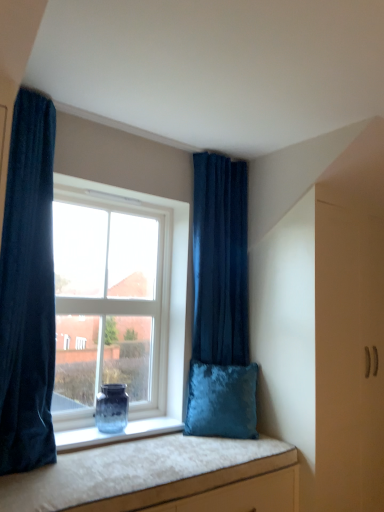
Question: Are translucent glass vase at window and velvet blue pillow at window beside each other?

Choices:
 (A) no
 (B) yes

Answer: (A)

Question: Can you confirm if translucent glass vase at window is positioned to the right of velvet blue pillow at window?

Choices:
 (A) no
 (B) yes

Answer: (A)

Question: Is translucent glass vase at window not within velvet blue pillow at window?

Choices:
 (A) yes
 (B) no

Answer: (A)

Question: From the image's perspective, is translucent glass vase at window below velvet blue pillow at window?

Choices:
 (A) yes
 (B) no

Answer: (A)

Question: From a real-world perspective, is translucent glass vase at window under velvet blue pillow at window?

Choices:
 (A) no
 (B) yes

Answer: (B)

Question: Is translucent glass vase at window oriented towards velvet blue pillow at window?

Choices:
 (A) yes
 (B) no

Answer: (B)

Question: Is clear glass window at center located outside velvet dark blue curtain at left, positioned as the 1th curtain in front-to-back order?

Choices:
 (A) no
 (B) yes

Answer: (B)

Question: Could you tell me if clear glass window at center is turned towards velvet dark blue curtain at left, which is counted as the second curtain, starting from the right?

Choices:
 (A) no
 (B) yes

Answer: (A)

Question: Is clear glass window at center taller than velvet dark blue curtain at left, arranged as the 1th curtain when viewed from the left?

Choices:
 (A) yes
 (B) no

Answer: (B)

Question: Is clear glass window at center further to the viewer compared to velvet dark blue curtain at left, which is counted as the second curtain, starting from the right?

Choices:
 (A) yes
 (B) no

Answer: (A)

Question: Is clear glass window at center at the right side of velvet dark blue curtain at left, the 2th curtain when ordered from back to front?

Choices:
 (A) yes
 (B) no

Answer: (A)

Question: Is clear glass window at center not near velvet dark blue curtain at left, the 2th curtain when ordered from back to front?

Choices:
 (A) no
 (B) yes

Answer: (A)

Question: Is velvet dark blue curtain at left, which is counted as the second curtain, starting from the right, to the right of velvet cushion at lower center from the viewer's perspective?

Choices:
 (A) no
 (B) yes

Answer: (A)